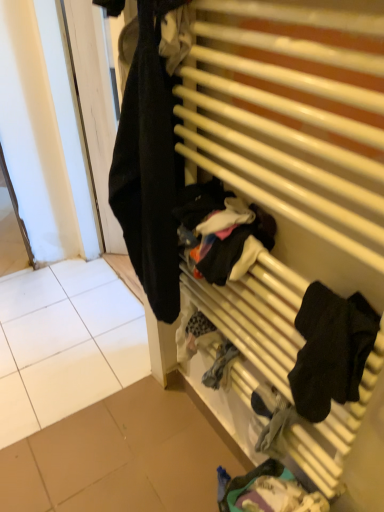
Question: Considering the relative positions of wooden radiator at right and dark blue fabric at lower center, positioned as the 1th clothing in bottom-to-top order, in the image provided, is wooden radiator at right to the left or to the right of dark blue fabric at lower center, positioned as the 1th clothing in bottom-to-top order,?

Choices:
 (A) left
 (B) right

Answer: (A)

Question: Is point (223, 26) positioned closer to the camera than point (258, 467)?

Choices:
 (A) closer
 (B) farther

Answer: (A)

Question: Which object is positioned farthest from the dark blue fabric at lower center, positioned as the 1th clothing in bottom-to-top order?

Choices:
 (A) wooden radiator at right
 (B) black fabric socks at right, the 2th clothing from the top
 (C) black fabric at left, which is counted as the 1th clothing, starting from the top
 (D) white tile at left

Answer: (D)

Question: Considering the real-world distances, which object is farthest from the dark blue fabric at lower center, positioned as the 1th clothing in bottom-to-top order?

Choices:
 (A) wooden radiator at right
 (B) black fabric socks at right, marked as the second clothing in a bottom-to-top arrangement
 (C) white tile at left
 (D) black fabric at left, which is counted as the 1th clothing, starting from the top

Answer: (C)